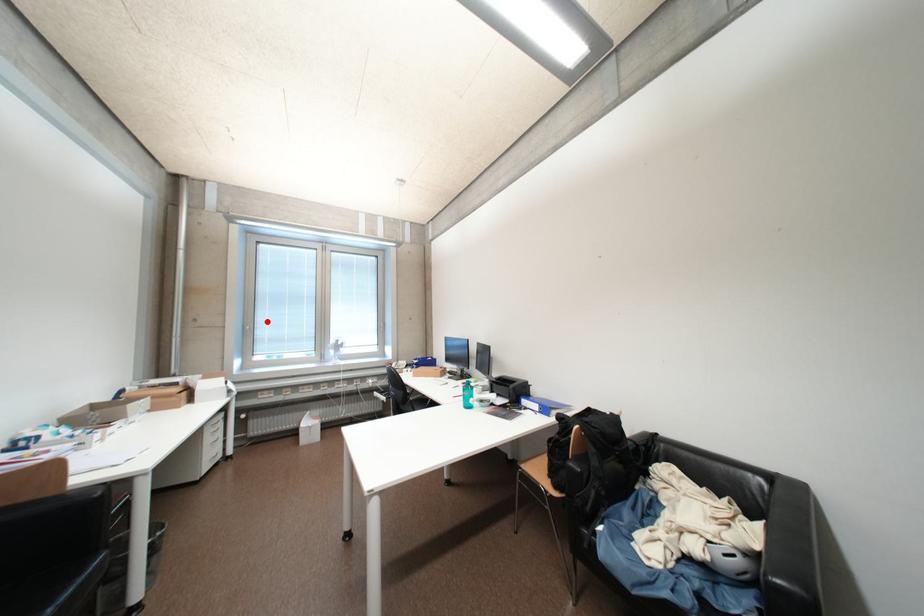
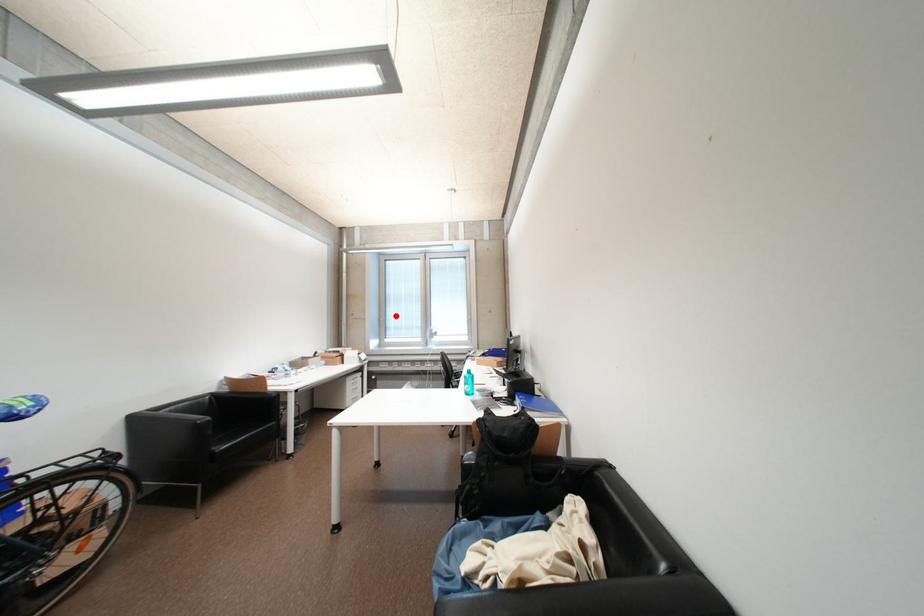
I am providing you with two images of the same scene from different viewpoints. A red point is marked on the first image and another point is marked on the second image. Do the highlighted points in image1 and image2 indicate the same real-world spot?

Yes